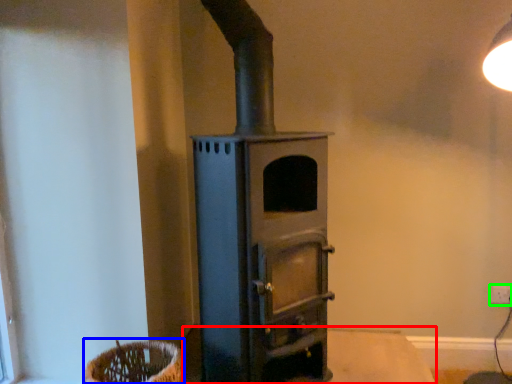
Question: Considering the real-world distances, which object is farthest from table (highlighted by a red box)? basket (highlighted by a blue box) or electric outlet (highlighted by a green box)?

Choices:
 (A) basket
 (B) electric outlet

Answer: (A)